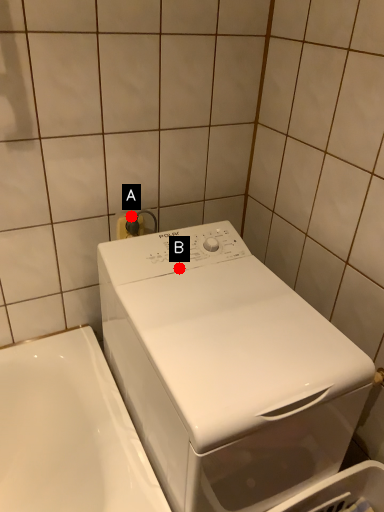
Question: Two points are circled on the image, labeled by A and B beside each circle. Which point appears farthest from the camera in this image?

Choices:
 (A) A is further
 (B) B is further

Answer: (A)